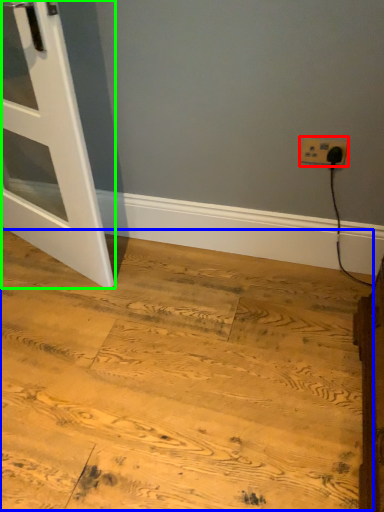
Question: Considering the real-world distances, which object is closest to power plugs and sockets (highlighted by a red box)? plywood (highlighted by a blue box) or door (highlighted by a green box).

Choices:
 (A) plywood
 (B) door

Answer: (A)